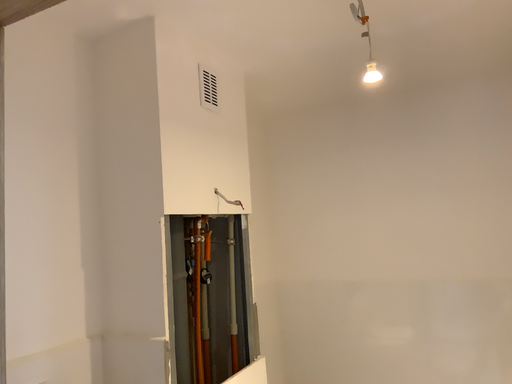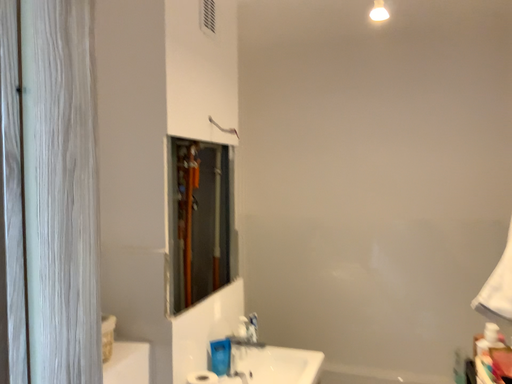
Question: Which way did the camera rotate in the video?

Choices:
 (A) rotated right
 (B) rotated left

Answer: (A)